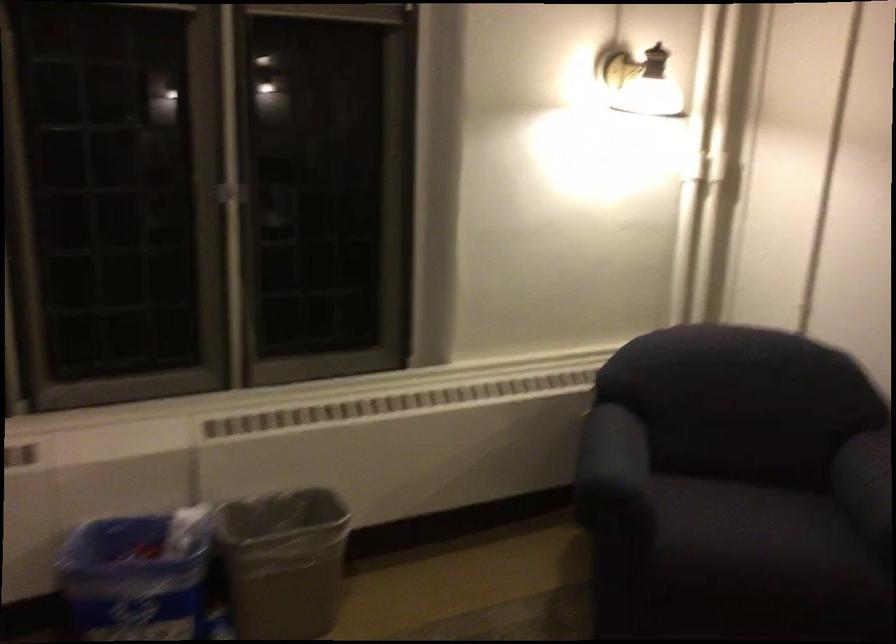
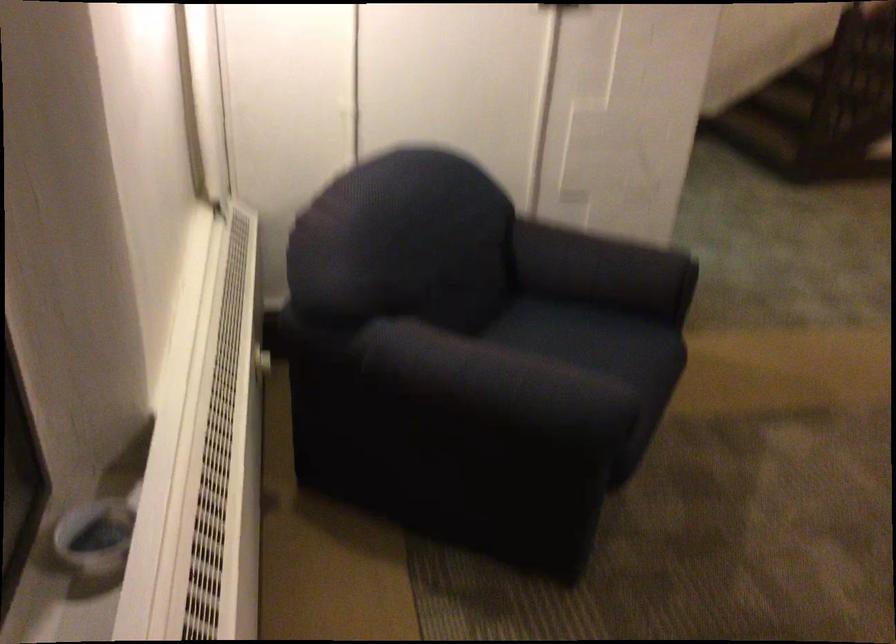
Locate, in the second image, the point that corresponds to point 741,518 in the first image.

(601, 355)